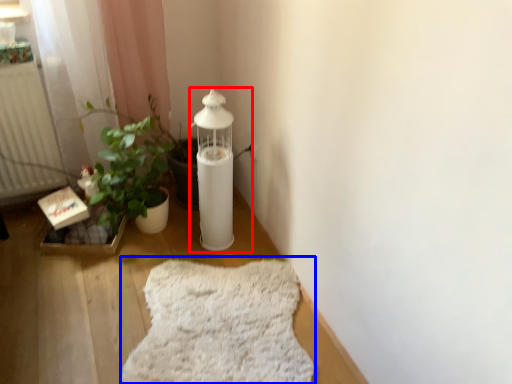
Question: Which object appears closest to the camera in this image, oil lamp (highlighted by a red box) or blanket (highlighted by a blue box)?

Choices:
 (A) oil lamp
 (B) blanket

Answer: (B)